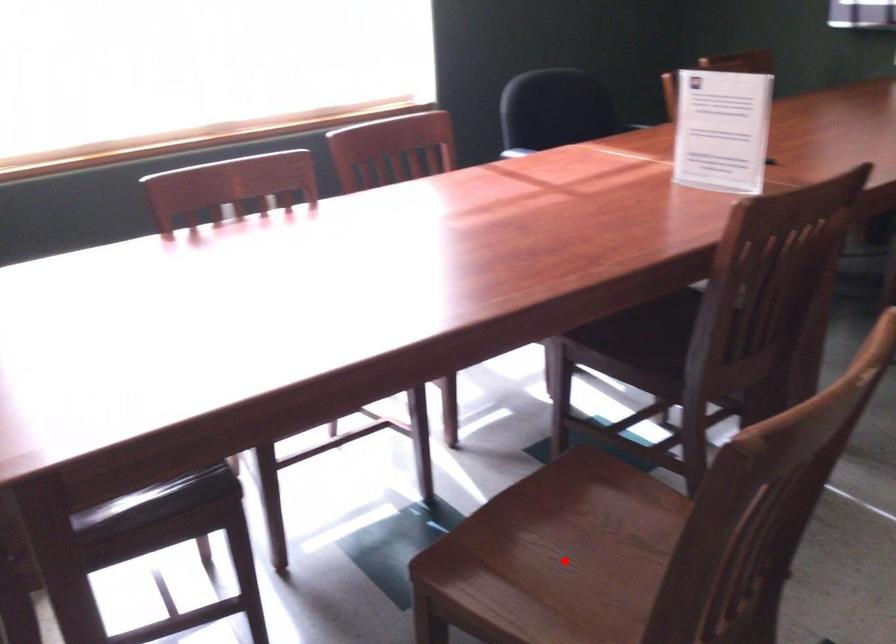
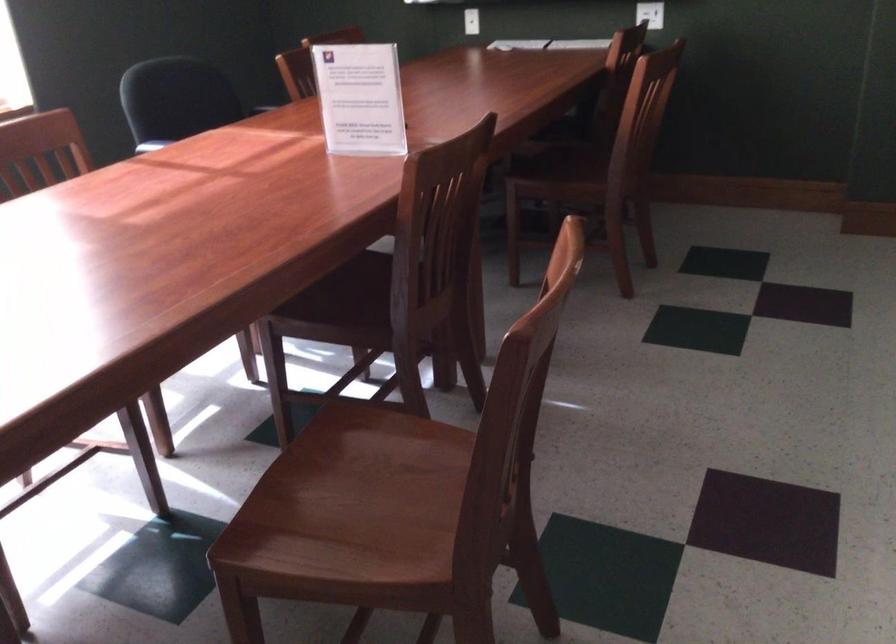
The point at the highlighted location is marked in the first image. Where is the corresponding point in the second image?

(351, 504)